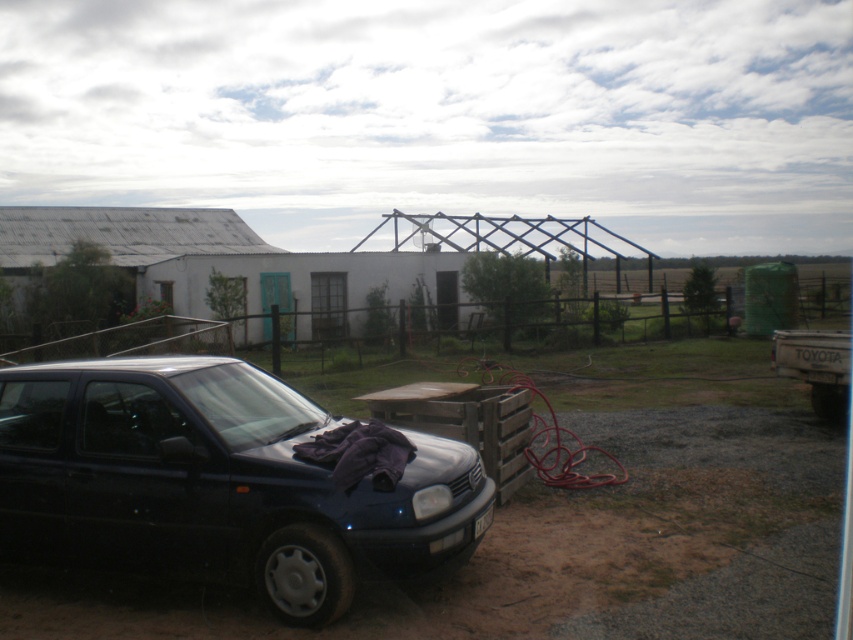
Question: Does black matte car at lower left appear on the left side of black plastic license plate at lower center?

Choices:
 (A) yes
 (B) no

Answer: (B)

Question: Which object is closer to the camera taking this photo?

Choices:
 (A) black plastic license plate at lower center
 (B) black matte car at lower left
 (C) shiny black car at lower left

Answer: (B)

Question: Does shiny black car at lower left appear under black plastic license plate at lower center?

Choices:
 (A) yes
 (B) no

Answer: (B)

Question: Estimate the real-world distances between objects in this image. Which object is closer to the shiny black car at lower left?

Choices:
 (A) black matte car at lower left
 (B) black plastic license plate at lower center

Answer: (B)

Question: Which of the following is the farthest from the observer?

Choices:
 (A) black matte car at lower left
 (B) black plastic license plate at lower center

Answer: (B)

Question: Is black matte car at lower left in front of black plastic license plate at lower center?

Choices:
 (A) yes
 (B) no

Answer: (A)